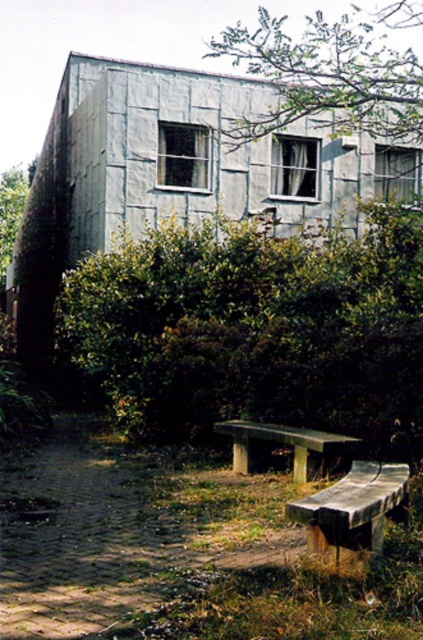
Question: Which point is closer to the camera?

Choices:
 (A) green leafy tree at left
 (B) smooth concrete bench at center
 (C) wooden bench at lower center

Answer: (C)

Question: Which point is farther from the camera taking this photo?

Choices:
 (A) (335, 545)
 (B) (247, 237)
 (C) (302, 481)
 (D) (115, 132)

Answer: (D)

Question: Can you confirm if metallic gray hut at center is positioned below smooth concrete bench at center?

Choices:
 (A) no
 (B) yes

Answer: (A)

Question: Does green leafy hedge at center appear on the left side of metallic gray hut at center?

Choices:
 (A) yes
 (B) no

Answer: (B)

Question: Is green leafy hedge at center to the right of smooth concrete bench at center from the viewer's perspective?

Choices:
 (A) yes
 (B) no

Answer: (B)

Question: Among these points, which one is farthest from the camera?

Choices:
 (A) click(x=19, y=288)
 (B) click(x=323, y=445)

Answer: (A)